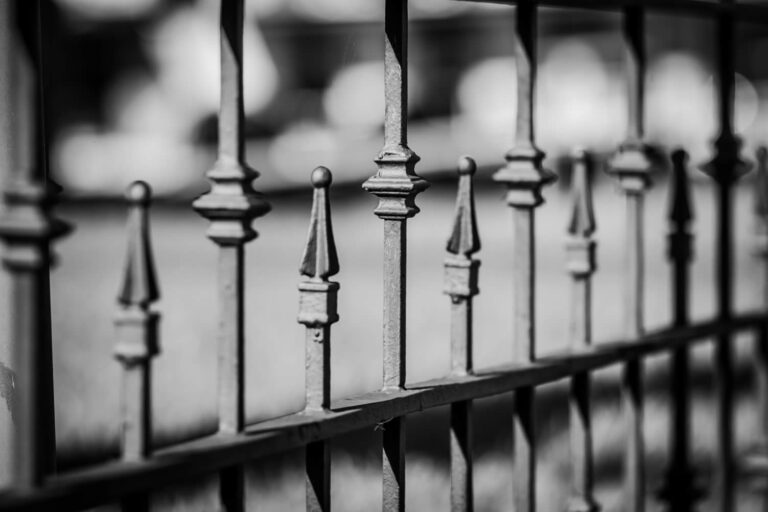
Find the location of a particular element. rod is located at coordinates (629, 297).